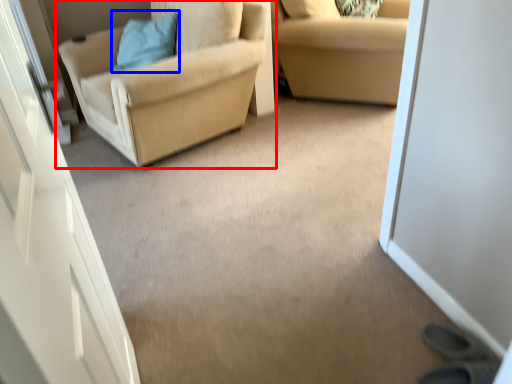
Question: Which of the following is the closest to the observer, chair (highlighted by a red box) or pillow (highlighted by a blue box)?

Choices:
 (A) chair
 (B) pillow

Answer: (A)